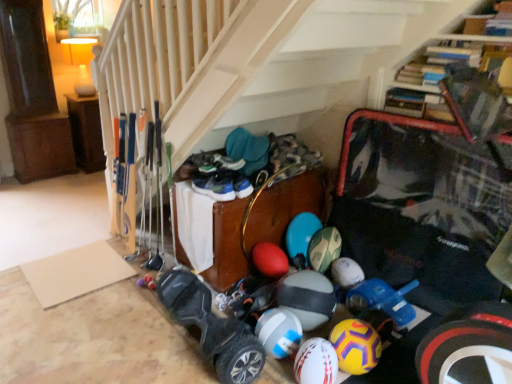
In order to click on blank space to the left of black rubber hoverboard at lower center in this screenshot , I will do `click(122, 337)`.